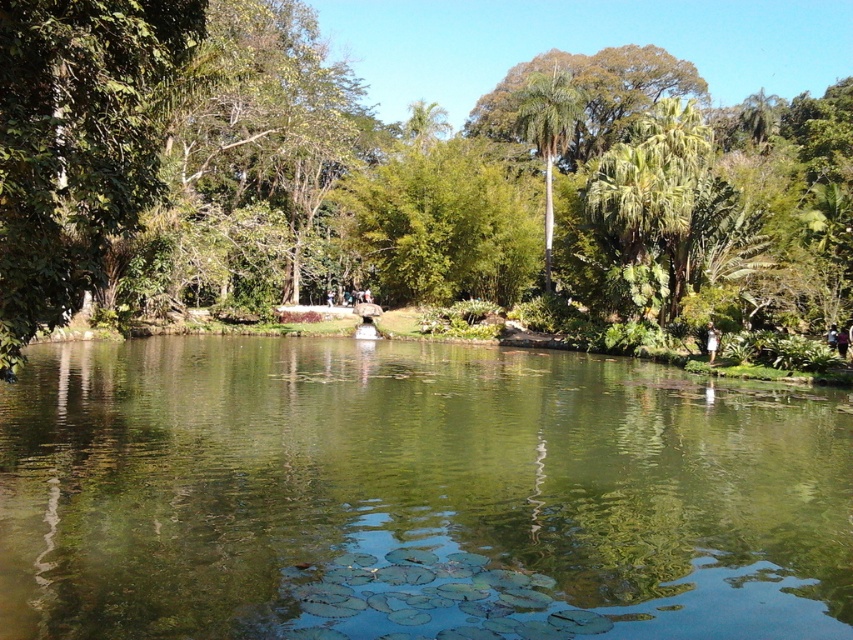
You are standing on the stone bridge in the middle ground of the pond. You see a green leafy tree at center and a green leafy palm tree at center. Which one is more to the left?

The green leafy tree at center is more to the left because it is positioned on the left side of the green leafy palm tree at center.

You are planning to place a small wooden bench between the green leafy tree at center and the green leafy palm tree at center. Which tree should the bench be closer to if you want it to be near the smaller tree?

The bench should be closer to the green leafy palm tree at center because it is smaller than the green leafy tree at center.

You are standing at the edge of the pond and want to take a photo that includes both the green reflective water at center and the green leafy palm tree at center. Which object will appear larger in the photo?

The green leafy palm tree at center will appear larger in the photo because it occupies more space than the green reflective water at center.